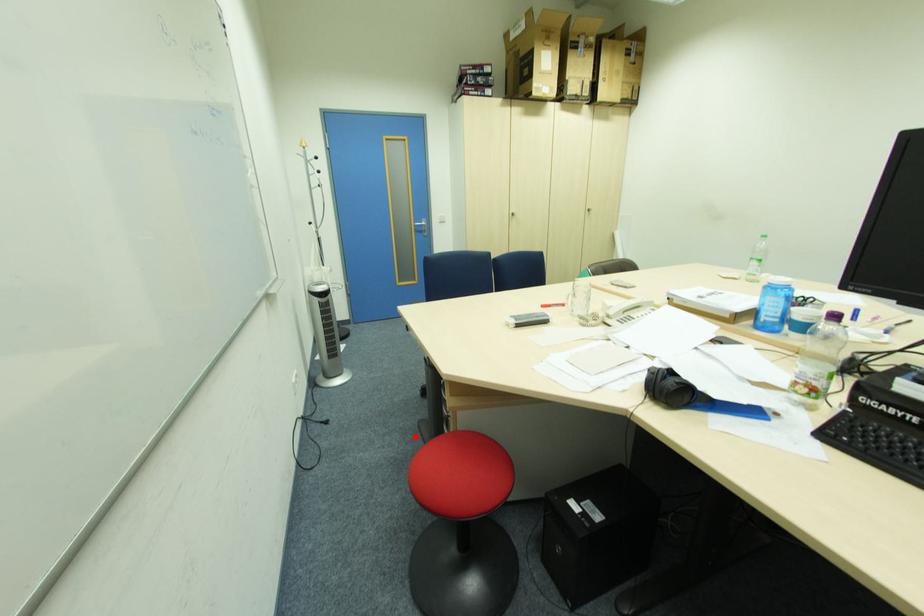
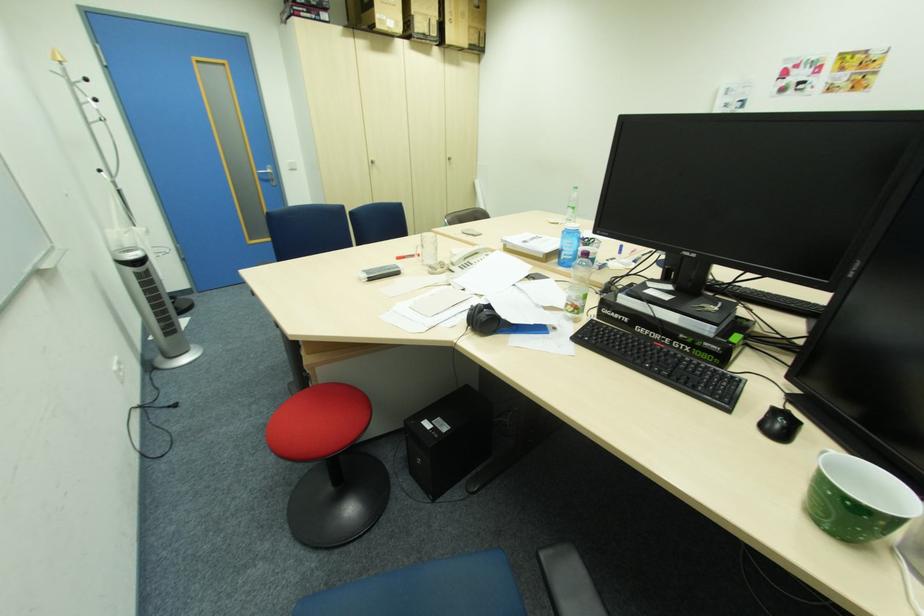
Locate, in the second image, the point that corresponds to the highlighted location in the first image.

(285, 400)